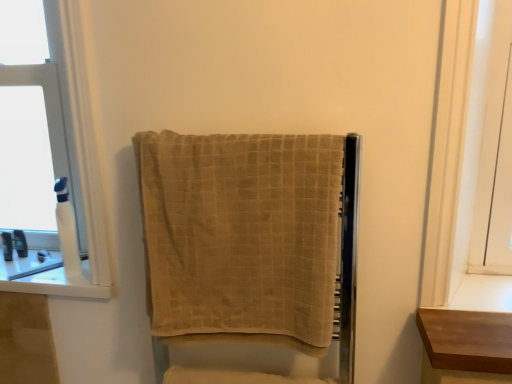
Question: Is white glossy window sill at left bigger than white plastic bottle at left, acting as the first toiletry starting from the right?

Choices:
 (A) yes
 (B) no

Answer: (A)

Question: Is white glossy window sill at left positioned behind white plastic bottle at left, acting as the first toiletry starting from the right?

Choices:
 (A) no
 (B) yes

Answer: (B)

Question: Can you confirm if white glossy window sill at left is shorter than white plastic bottle at left, acting as the third toiletry starting from the back?

Choices:
 (A) yes
 (B) no

Answer: (A)

Question: From a real-world perspective, is white glossy window sill at left below white plastic bottle at left, acting as the first toiletry starting from the right?

Choices:
 (A) no
 (B) yes

Answer: (B)

Question: Is white glossy window sill at left taller than white plastic bottle at left, acting as the third toiletry starting from the back?

Choices:
 (A) yes
 (B) no

Answer: (B)

Question: Visually, is beige textured towel at center positioned to the left or to the right of translucent plastic bottle at left, the second toiletry viewed from the front?

Choices:
 (A) right
 (B) left

Answer: (A)

Question: Is beige textured towel at center situated inside translucent plastic bottle at left, the second toiletry viewed from the front, or outside?

Choices:
 (A) inside
 (B) outside

Answer: (B)

Question: In terms of size, does beige textured towel at center appear bigger or smaller than translucent plastic bottle at left, the second toiletry viewed from the front?

Choices:
 (A) big
 (B) small

Answer: (A)

Question: From their relative heights in the image, would you say beige textured towel at center is taller or shorter than translucent plastic bottle at left, the 1th toiletry positioned from the left?

Choices:
 (A) short
 (B) tall

Answer: (B)

Question: Is beige textured towel at center spatially inside white plastic bottle at left, acting as the third toiletry starting from the back, or outside of it?

Choices:
 (A) outside
 (B) inside

Answer: (A)

Question: From a real-world perspective, is beige textured towel at center positioned above or below white plastic bottle at left, acting as the first toiletry starting from the right?

Choices:
 (A) above
 (B) below

Answer: (A)

Question: From the image's perspective, is beige textured towel at center above or below white plastic bottle at left, acting as the third toiletry starting from the back?

Choices:
 (A) above
 (B) below

Answer: (B)

Question: Looking at the image, does beige textured towel at center seem bigger or smaller compared to white plastic bottle at left, the first toiletry from the front?

Choices:
 (A) small
 (B) big

Answer: (B)

Question: Is point (141, 187) positioned closer to the camera than point (19, 231)?

Choices:
 (A) farther
 (B) closer

Answer: (B)

Question: From a real-world perspective, relative to translucent plastic bottle at left, the 2th toiletry positioned from the left, is beige textured towel at center vertically above or below?

Choices:
 (A) above
 (B) below

Answer: (A)